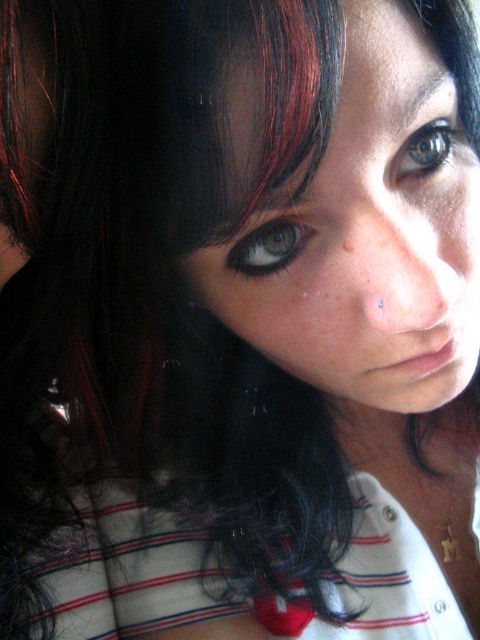
Looking at the person in the image, which feature is positioned higher up on their face between the green matte eye at upper center and the brown matte freckle at center?

The green matte eye at upper center is located above the brown matte freckle at center, so it is positioned higher up on the face.

You are a photographer trying to capture a close portrait. The subject has a matte skin face at center. You want to ensure proper focus on their face while keeping the background blurred. Given the current camera settings, the depth of field allows for sharpness within a 30 cm range. Can the subject maintain their current position without moving their head to ensure their face stays in focus?

The subject has a matte skin face at center. The distance between the subject and the camera is 29.63 centimeters. Since the depth of field allows for sharpness within a 30 cm range, the subject can maintain their current position without moving their head, and their face will stay in focus.